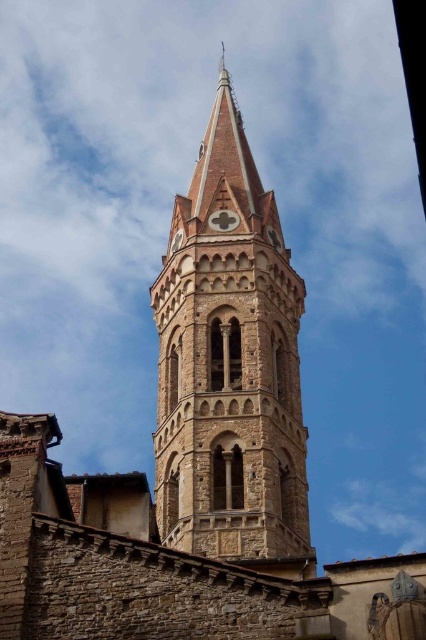
Question: Is brown stone tower at center smaller than matte stone clock at upper center?

Choices:
 (A) no
 (B) yes

Answer: (A)

Question: Which point is farther to the camera?

Choices:
 (A) brown stone tower at center
 (B) matte stone clock at upper center

Answer: (B)

Question: Is brown stone tower at center closer to the viewer compared to matte stone clock at upper center?

Choices:
 (A) yes
 (B) no

Answer: (A)

Question: Can you confirm if brown stone tower at center is positioned below matte stone clock at upper center?

Choices:
 (A) no
 (B) yes

Answer: (A)